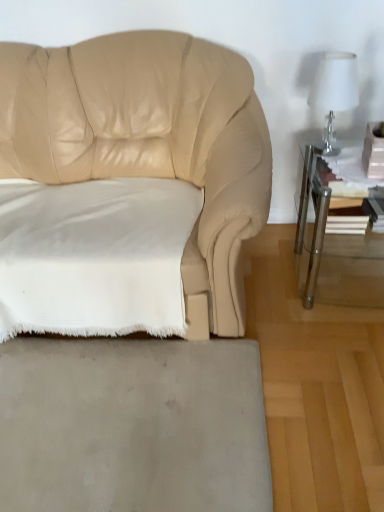
What is the approximate height of clear glass table at right?

The height of clear glass table at right is 50.99 centimeters.

Measure the distance between clear glass table at right and camera.

They are 4.86 feet apart.

Find the location of `gray matte rug at lower center`. gray matte rug at lower center is located at coordinates (132, 425).

Identify the location of clear glass table at right. The image size is (384, 512). (335, 244).

Which is in front, clear glass table lamp at upper right or white soft fabric pillow at lower left?

A: white soft fabric pillow at lower left is closer to the camera.

In the scene shown: From the image's perspective, does clear glass table lamp at upper right appear lower than white soft fabric pillow at lower left?

No, from the image's perspective, clear glass table lamp at upper right is not below white soft fabric pillow at lower left.

Which point is more distant from viewer, (332, 83) or (72, 322)?

The point (72, 322) is more distant.

From a real-world perspective, which is physically below, clear glass table lamp at upper right or white soft fabric pillow at lower left?

white soft fabric pillow at lower left is physically lower.

Which object is wider, clear glass table lamp at upper right or clear glass table at right?

clear glass table at right is wider.

Does clear glass table lamp at upper right touch clear glass table at right?

clear glass table lamp at upper right and clear glass table at right are clearly separated.

In the scene shown: Considering the positions of objects clear glass table lamp at upper right and clear glass table at right in the image provided, who is more to the right, clear glass table lamp at upper right or clear glass table at right?

clear glass table at right.

Measure the distance from clear glass table lamp at upper right to clear glass table at right.

clear glass table lamp at upper right is 13.78 inches away from clear glass table at right.

Between point (264, 479) and point (330, 138), which one is positioned in front?

The point (264, 479) is closer.

Is gray matte rug at lower center directly adjacent to clear glass table lamp at upper right?

No.

Who is shorter, gray matte rug at lower center or clear glass table lamp at upper right?

Standing shorter between the two is gray matte rug at lower center.

How distant is white soft fabric pillow at lower left from gray matte rug at lower center?

white soft fabric pillow at lower left and gray matte rug at lower center are 13.86 inches apart from each other.

Is point (35, 226) closer or farther from the camera than point (126, 346)?

Point (35, 226).

Which object is thinner, white soft fabric pillow at lower left or gray matte rug at lower center?

white soft fabric pillow at lower left is thinner.

Is white soft fabric pillow at lower left placed right next to gray matte rug at lower center?

white soft fabric pillow at lower left and gray matte rug at lower center are clearly separated.

Is the position of gray matte rug at lower center less distant than that of white soft fabric pillow at lower left?

Yes, gray matte rug at lower center is closer to the viewer.

How many degrees apart are the facing directions of gray matte rug at lower center and white soft fabric pillow at lower left?

1.9 degrees.

Image resolution: width=384 pixels, height=512 pixels. Find the location of `pillow that appears on the left of gray matte rug at lower center`. pillow that appears on the left of gray matte rug at lower center is located at coordinates (94, 256).

Does point (97, 410) appear closer or farther from the camera than point (71, 233)?

Point (97, 410) is closer to the camera than point (71, 233).

Considering the sizes of clear glass table at right and white soft fabric pillow at lower left in the image, is clear glass table at right bigger or smaller than white soft fabric pillow at lower left?

In the image, clear glass table at right appears to be smaller than white soft fabric pillow at lower left.

From the image's perspective, which one is positioned higher, clear glass table at right or white soft fabric pillow at lower left?

clear glass table at right appears higher in the image.

Considering the relative positions of clear glass table at right and white soft fabric pillow at lower left in the image provided, is clear glass table at right to the left of white soft fabric pillow at lower left from the viewer's perspective?

Incorrect, clear glass table at right is not on the left side of white soft fabric pillow at lower left.

Which is farther from the camera, [322,221] or [121,228]?

Point [322,221]

The width and height of the screenshot is (384, 512). In the image, there is a white soft fabric pillow at lower left. In order to click on table above it (from the image's perspective) in this screenshot , I will do `click(335, 244)`.

Are white soft fabric pillow at lower left and clear glass table at right far apart?

white soft fabric pillow at lower left is near clear glass table at right, not far away.

Considering the relative sizes of white soft fabric pillow at lower left and clear glass table at right in the image provided, is white soft fabric pillow at lower left thinner than clear glass table at right?

No.

Can you confirm if white soft fabric pillow at lower left is taller than clear glass table at right?

Incorrect, the height of white soft fabric pillow at lower left is not larger of that of clear glass table at right.

The height and width of the screenshot is (512, 384). Find the location of `pillow in front of the clear glass table lamp at upper right`. pillow in front of the clear glass table lamp at upper right is located at coordinates (94, 256).

I want to click on table below the clear glass table lamp at upper right (from a real-world perspective), so click(335, 244).

From the image, which object appears to be nearer to clear glass table lamp at upper right, white soft fabric pillow at lower left or gray matte rug at lower center?

white soft fabric pillow at lower left lies closer to clear glass table lamp at upper right than the other object.

When comparing their distances from gray matte rug at lower center, does clear glass table lamp at upper right or clear glass table at right seem closer?

Among the two, clear glass table at right is located nearer to gray matte rug at lower center.

Considering their positions, is clear glass table lamp at upper right positioned closer to clear glass table at right than white soft fabric pillow at lower left?

clear glass table lamp at upper right is closer to clear glass table at right.

When comparing their distances from clear glass table at right, does white soft fabric pillow at lower left or clear glass table lamp at upper right seem closer?

clear glass table lamp at upper right is closer to clear glass table at right.

Considering their positions, is gray matte rug at lower center positioned closer to white soft fabric pillow at lower left than clear glass table at right?

gray matte rug at lower center.

Looking at the image, which one is located further to clear glass table at right, clear glass table lamp at upper right or gray matte rug at lower center?

gray matte rug at lower center is positioned further to the anchor clear glass table at right.

When comparing their distances from gray matte rug at lower center, does clear glass table lamp at upper right or white soft fabric pillow at lower left seem closer?

white soft fabric pillow at lower left.

When comparing their distances from white soft fabric pillow at lower left, does clear glass table lamp at upper right or gray matte rug at lower center seem further?

clear glass table lamp at upper right lies further to white soft fabric pillow at lower left than the other object.

Where is `table between clear glass table lamp at upper right and gray matte rug at lower center vertically`? The image size is (384, 512). table between clear glass table lamp at upper right and gray matte rug at lower center vertically is located at coordinates (335, 244).

This screenshot has height=512, width=384. Find the location of `table lamp between white soft fabric pillow at lower left and clear glass table at right in the horizontal direction`. table lamp between white soft fabric pillow at lower left and clear glass table at right in the horizontal direction is located at coordinates (334, 92).

Image resolution: width=384 pixels, height=512 pixels. In order to click on pillow between clear glass table lamp at upper right and gray matte rug at lower center from top to bottom in this screenshot , I will do `click(94, 256)`.

The width and height of the screenshot is (384, 512). What are the coordinates of `concrete between white soft fabric pillow at lower left and clear glass table at right in the horizontal direction` in the screenshot? It's located at (132, 425).